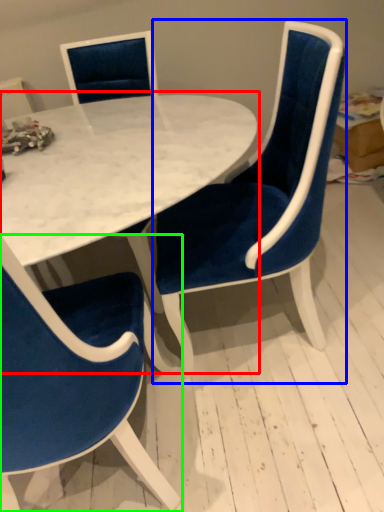
Question: Which object is positioned closest to table (highlighted by a red box)? Select from chair (highlighted by a blue box) and chair (highlighted by a green box).

Choices:
 (A) chair
 (B) chair

Answer: (A)